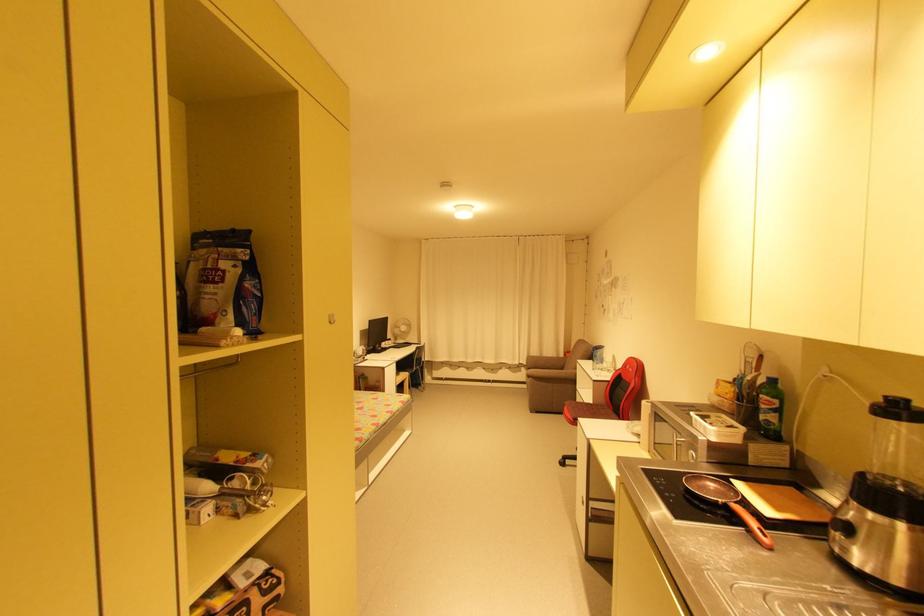
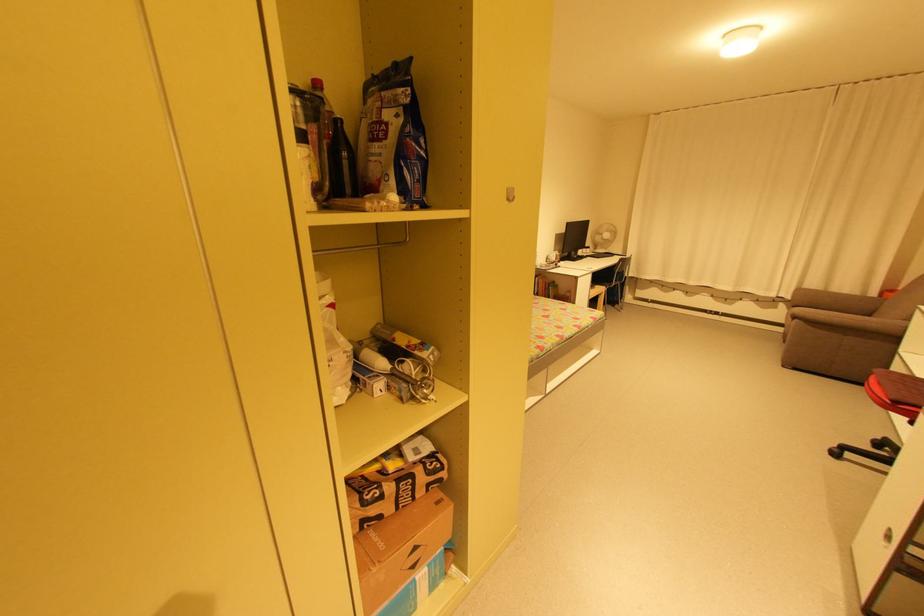
Where in the second image is the point corresponding to pixel 220 283 from the first image?

(383, 140)